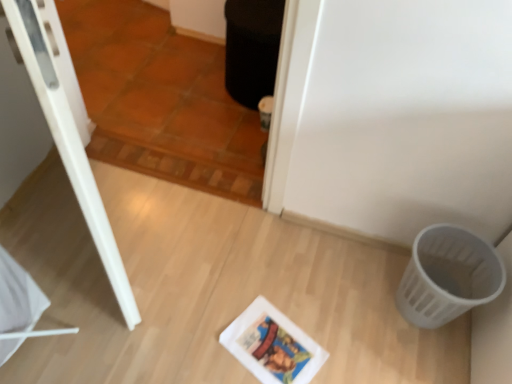
The image size is (512, 384). I want to click on vacant space underneath matte white comic book at center (from a real-world perspective), so click(x=274, y=350).